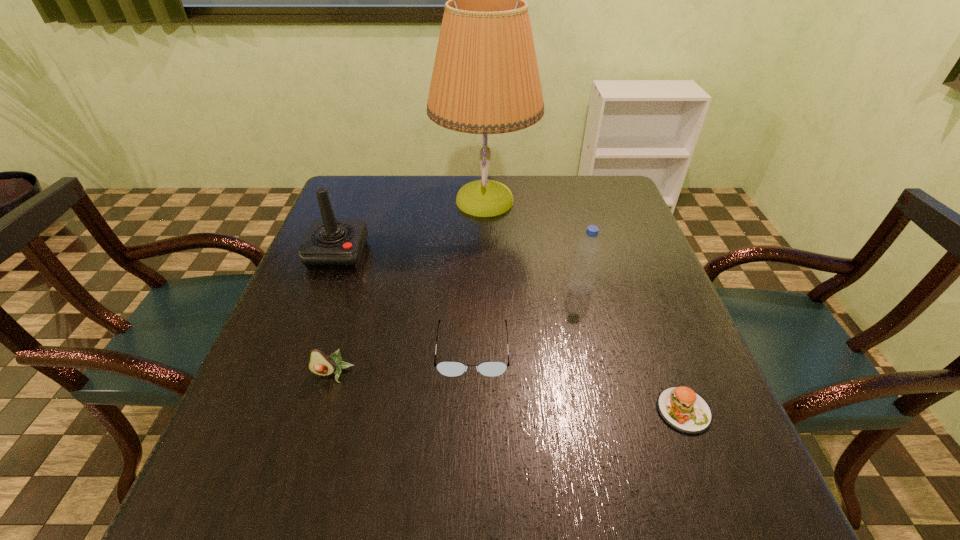
Where is `free space between the avocado and the farthest object`? This screenshot has width=960, height=540. free space between the avocado and the farthest object is located at coordinates (409, 287).

This screenshot has height=540, width=960. I want to click on free space between the nearest object and the joystick, so click(511, 332).

At what (x,y) coordinates should I click in order to perform the action: click on free area in between the avocado and the joystick. Please return your answer as a coordinate pair (x, y). The width and height of the screenshot is (960, 540). Looking at the image, I should click on (335, 314).

What are the coordinates of `empty location between the rightmost object and the joystick` in the screenshot? It's located at (511, 332).

At what (x,y) coordinates should I click in order to perform the action: click on vacant region between the rightmost object and the fourth tallest object. Please return your answer as a coordinate pair (x, y). This screenshot has height=540, width=960. Looking at the image, I should click on (508, 393).

Find the location of a particular element. This screenshot has width=960, height=540. free space between the tallest object and the nearest object is located at coordinates (584, 305).

Locate an element on the screen. free space between the fifth nearest object and the fourth tallest object is located at coordinates (335, 314).

This screenshot has height=540, width=960. What are the coordinates of `vacant region between the rightmost object and the third shortest object` in the screenshot? It's located at (508, 393).

Locate an element on the screen. The image size is (960, 540). vacant area that lies between the third shortest object and the joystick is located at coordinates (335, 314).

Where is `object that is the closest to the rightmost object`? This screenshot has width=960, height=540. object that is the closest to the rightmost object is located at coordinates (582, 280).